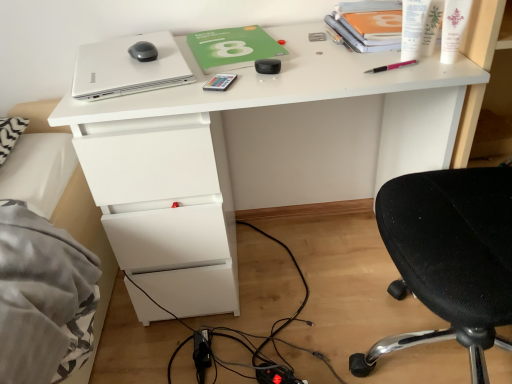
What are the coordinates of `vacant space to the left of metallic rectangular object at center, which is the fourth stationery in right-to-left order` in the screenshot? It's located at pyautogui.click(x=154, y=97).